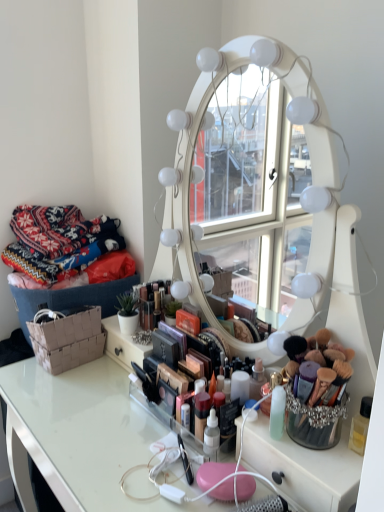
What are the coordinates of `free location in front of brown woven basket at lower left` in the screenshot? It's located at point(48,394).